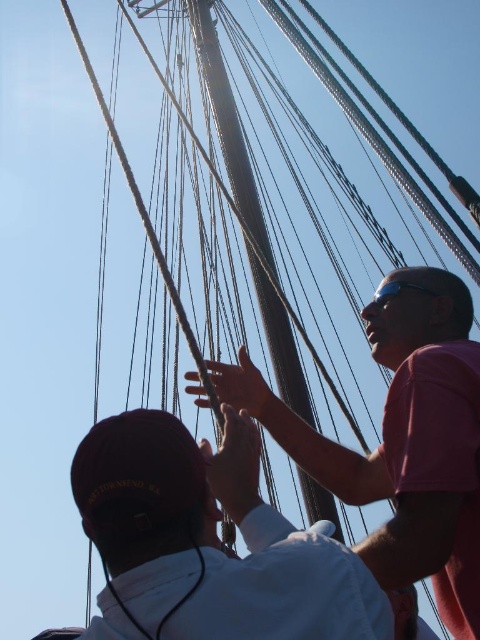
Question: Can you confirm if pink matte shirt at upper right is thinner than smooth wood mast at center?

Choices:
 (A) no
 (B) yes

Answer: (A)

Question: Can you confirm if pink matte shirt at upper right is thinner than smooth wood mast at center?

Choices:
 (A) no
 (B) yes

Answer: (A)

Question: Which point is farther to the camera?

Choices:
 (A) pos(272,289)
 (B) pos(403,337)
 (C) pos(132,484)

Answer: (A)

Question: Which of the following is the farthest from the observer?

Choices:
 (A) smooth wood mast at center
 (B) white matte shirt at center

Answer: (A)

Question: Observing the image, what is the correct spatial positioning of white matte shirt at center in reference to pink matte shirt at upper right?

Choices:
 (A) left
 (B) right

Answer: (A)

Question: Estimate the real-world distances between objects in this image. Which object is farther from the pink matte shirt at upper right?

Choices:
 (A) smooth wood mast at center
 (B) white matte shirt at center

Answer: (A)